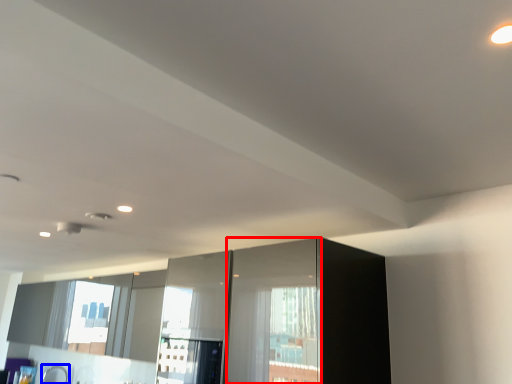
Question: Which of the following is the closest to the observer, screen door (highlighted by a red box) or faucet (highlighted by a blue box)?

Choices:
 (A) screen door
 (B) faucet

Answer: (A)